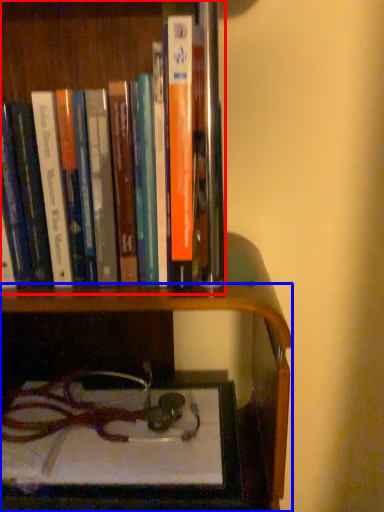
Question: Which object is closer to the camera taking this photo, book (highlighted by a red box) or shelf (highlighted by a blue box)?

Choices:
 (A) book
 (B) shelf

Answer: (A)